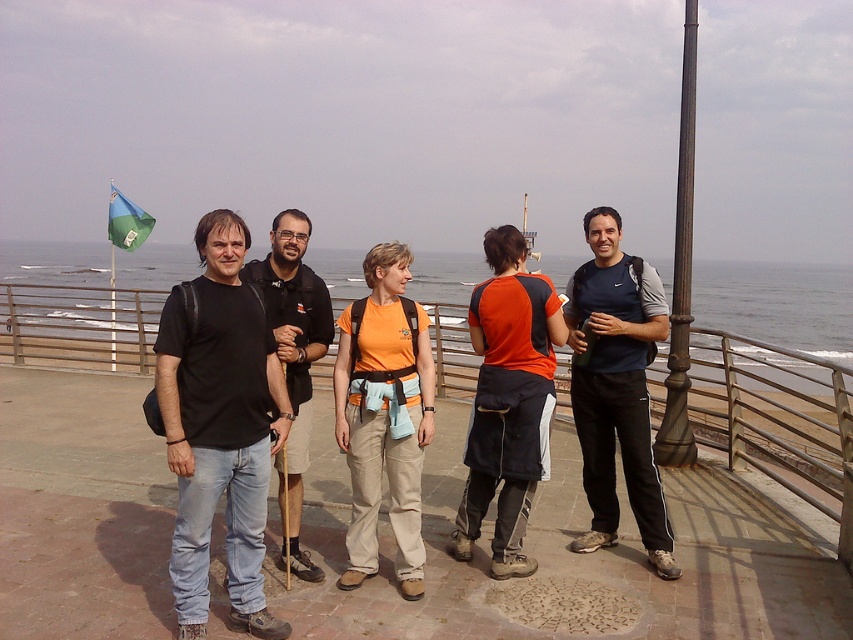
You are a photographer planning to take a group photo of the five people in the scene. You notice the metal at left and the blue fabric flag at upper left in the background. To avoid any of these items overlapping with the subjects, which object should you be more cautious about in terms of its height? Explain your reasoning.

The blue fabric flag at upper left is taller than the metal at left. Since the flag is taller, it might be more likely to overlap with the top of the subjects when framing the photo, so you should be more cautious about its height.